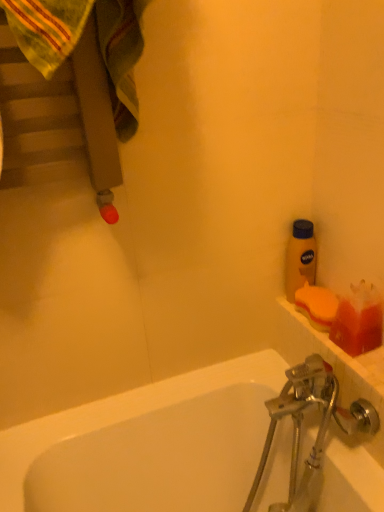
Question: Is translucent orange soap at right taller than yellow matte bottle at upper right?

Choices:
 (A) no
 (B) yes

Answer: (A)

Question: Is translucent orange soap at right at the left side of yellow matte bottle at upper right?

Choices:
 (A) yes
 (B) no

Answer: (B)

Question: Considering the relative sizes of translucent orange soap at right and yellow matte bottle at upper right in the image provided, is translucent orange soap at right shorter than yellow matte bottle at upper right?

Choices:
 (A) no
 (B) yes

Answer: (B)

Question: Can you confirm if translucent orange soap at right is wider than yellow matte bottle at upper right?

Choices:
 (A) no
 (B) yes

Answer: (B)

Question: Considering the relative positions of translucent orange soap at right and yellow matte bottle at upper right in the image provided, is translucent orange soap at right in front of yellow matte bottle at upper right?

Choices:
 (A) yes
 (B) no

Answer: (A)

Question: Is the surface of translucent orange soap at right in direct contact with yellow matte bottle at upper right?

Choices:
 (A) no
 (B) yes

Answer: (A)

Question: Does yellow matte bottle at upper right have a lesser width compared to orange sponge at right?

Choices:
 (A) no
 (B) yes

Answer: (B)

Question: Considering the relative sizes of yellow matte bottle at upper right and orange sponge at right in the image provided, is yellow matte bottle at upper right smaller than orange sponge at right?

Choices:
 (A) no
 (B) yes

Answer: (A)

Question: Can you confirm if yellow matte bottle at upper right is shorter than orange sponge at right?

Choices:
 (A) no
 (B) yes

Answer: (A)

Question: Is yellow matte bottle at upper right next to orange sponge at right?

Choices:
 (A) yes
 (B) no

Answer: (A)

Question: Considering the relative positions of yellow matte bottle at upper right and orange sponge at right in the image provided, is yellow matte bottle at upper right to the left of orange sponge at right from the viewer's perspective?

Choices:
 (A) no
 (B) yes

Answer: (B)

Question: From a real-world perspective, is yellow matte bottle at upper right positioned over orange sponge at right based on gravity?

Choices:
 (A) no
 (B) yes

Answer: (B)

Question: Is translucent orange soap at right thinner than orange sponge at right?

Choices:
 (A) no
 (B) yes

Answer: (B)